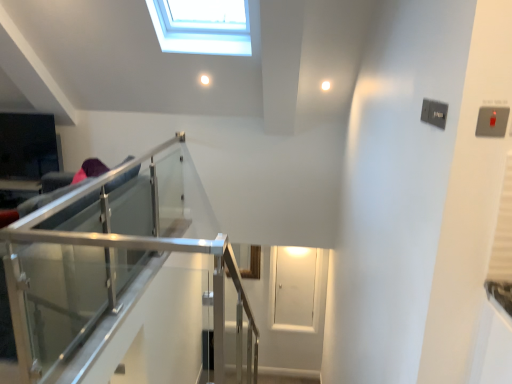
Question: Considering their positions, is transparent glass door at center located in front of or behind clear glass railing at left?

Choices:
 (A) behind
 (B) front

Answer: (A)

Question: Considering the positions of point (278, 324) and point (212, 249), is point (278, 324) closer or farther from the camera than point (212, 249)?

Choices:
 (A) closer
 (B) farther

Answer: (B)

Question: Considering the positions of transparent glass door at center and clear glass railing at left in the image, is transparent glass door at center bigger or smaller than clear glass railing at left?

Choices:
 (A) small
 (B) big

Answer: (A)

Question: Relative to transparent glass door at center, is clear glass railing at left in front or behind?

Choices:
 (A) behind
 (B) front

Answer: (B)

Question: In terms of height, does clear glass railing at left look taller or shorter compared to transparent glass door at center?

Choices:
 (A) tall
 (B) short

Answer: (A)

Question: Is point (157, 263) closer or farther from the camera than point (280, 296)?

Choices:
 (A) closer
 (B) farther

Answer: (A)

Question: Considering the positions of clear glass railing at left and transparent glass door at center in the image, is clear glass railing at left wider or thinner than transparent glass door at center?

Choices:
 (A) wide
 (B) thin

Answer: (A)